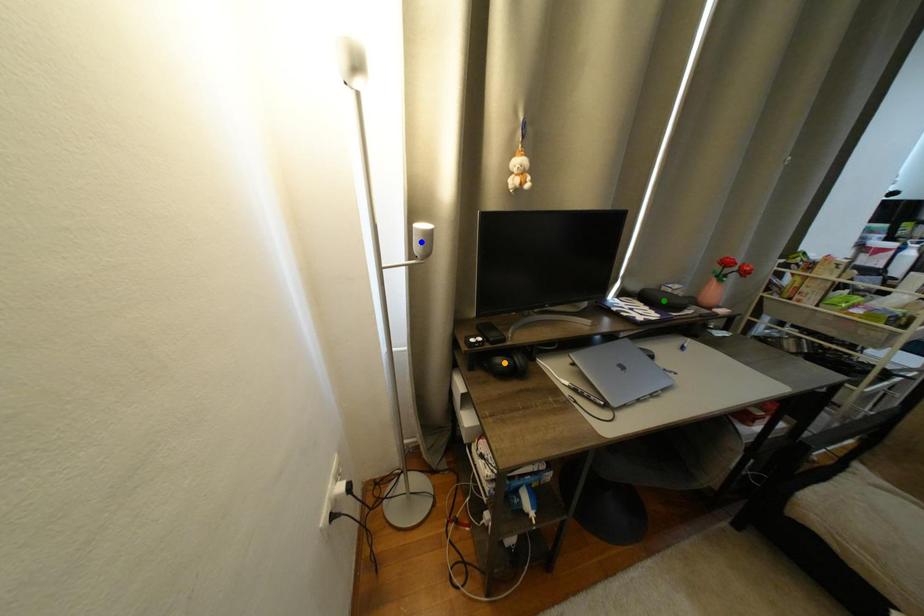
Order these from nearest to farthest:
green point | orange point | blue point

blue point → orange point → green point